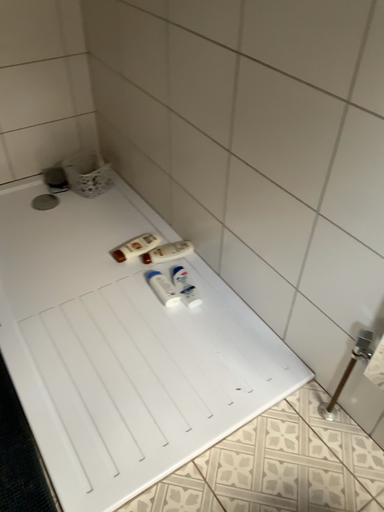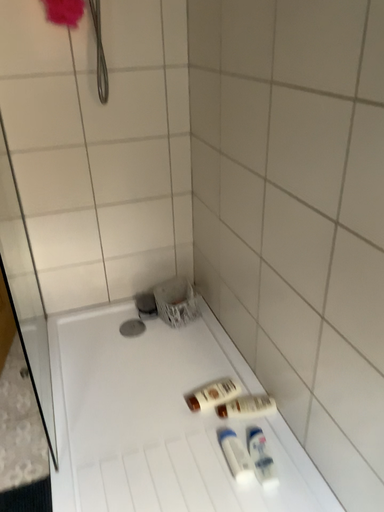
Question: How did the camera likely rotate when shooting the video?

Choices:
 (A) rotated left
 (B) rotated right

Answer: (A)